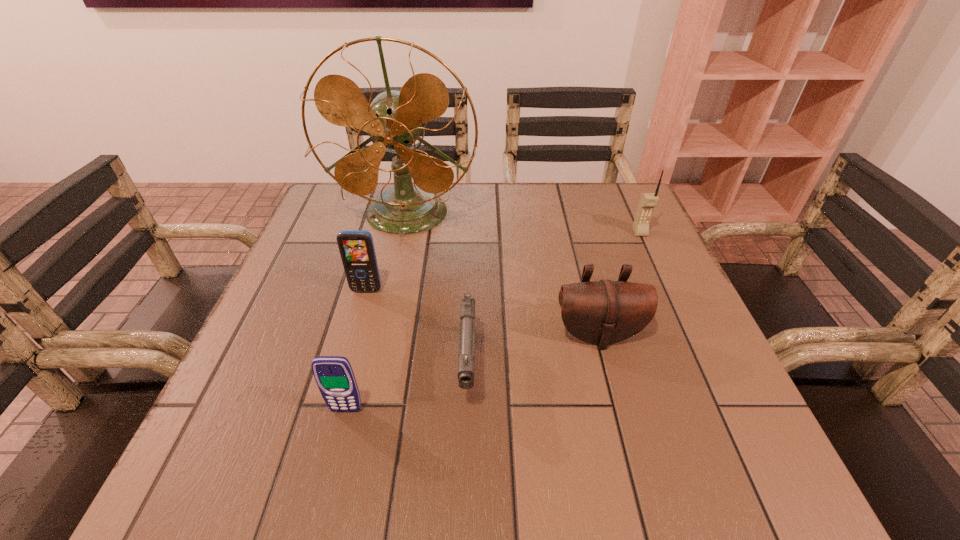
Image resolution: width=960 pixels, height=540 pixels. I want to click on free spot between the fan and the rightmost object, so click(x=523, y=223).

Locate an element on the screen. vacant point located between the rightmost cellular telephone and the shortest cellular telephone is located at coordinates (493, 321).

Locate an element on the screen. free space between the shortest cellular telephone and the tallest object is located at coordinates (376, 312).

Where is `vacant space that's between the fan and the fourth nearest object`? vacant space that's between the fan and the fourth nearest object is located at coordinates (386, 252).

You are a GUI agent. You are given a task and a screenshot of the screen. Output one action in this format:
    pyautogui.click(x=<x>, y=<y>)
    Task: Click on the vacant space that is in between the fifth object from left to right and the gun
    This screenshot has height=540, width=960.
    Given the screenshot: What is the action you would take?
    pyautogui.click(x=533, y=351)

Identify which object is the second closest to the shortest cellular telephone. Please provide its 2D coordinates. Your answer should be formatted as a tuple, i.e. [(x, y)], where the tuple contains the x and y coordinates of a point satisfying the conditions above.

[(356, 247)]

Identify which object is the third nearest to the third farthest object. Please provide its 2D coordinates. Your answer should be formatted as a tuple, i.e. [(x, y)], where the tuple contains the x and y coordinates of a point satisfying the conditions above.

[(334, 376)]

Choose which cellular telephone is the second nearest neighbor to the tallest object. Please provide its 2D coordinates. Your answer should be formatted as a tuple, i.e. [(x, y)], where the tuple contains the x and y coordinates of a point satisfying the conditions above.

[(648, 201)]

Point out which cellular telephone is positioned as the second nearest to the shortest cellular telephone. Please provide its 2D coordinates. Your answer should be formatted as a tuple, i.e. [(x, y)], where the tuple contains the x and y coordinates of a point satisfying the conditions above.

[(648, 201)]